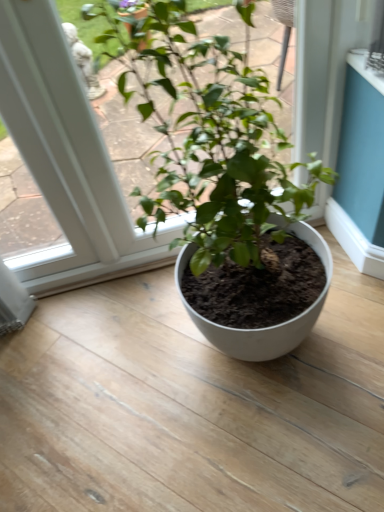
The width and height of the screenshot is (384, 512). What are the coordinates of `vacant position to the left of matte white pot at center` in the screenshot? It's located at (115, 367).